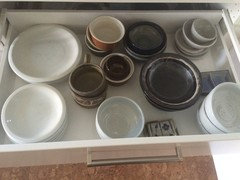
This screenshot has width=240, height=180. I want to click on front of drawer, so click(x=51, y=157).